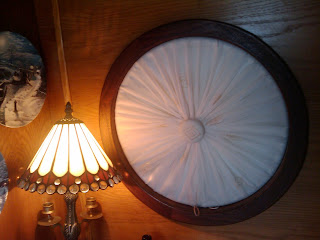
Find the location of a particular element. The image size is (320, 240). lamp shade is located at coordinates (81, 161).